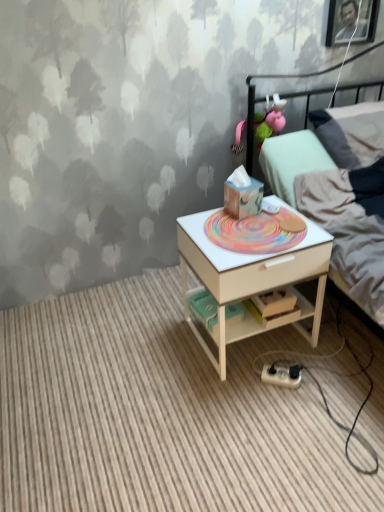
The image size is (384, 512). Identify the location of pink fabric toy at upper center. coord(269,120).

Identify the location of light gray fabric bed at upper right. (346, 215).

What do you see at coordinates (282, 375) in the screenshot?
I see `white plastic power strip at lower center` at bounding box center [282, 375].

This screenshot has height=512, width=384. Identify the location of pink fabric toy at upper center. (269, 120).

From the image's perspective, is white wood desk at center above or below light gray fabric bed at upper right?

Clearly, from the image's perspective, white wood desk at center is below light gray fabric bed at upper right.

Which point is more distant from viewer, (205, 258) or (336, 266)?

The point (336, 266) is farther from the camera.

Can you confirm if white wood desk at center is wider than light gray fabric bed at upper right?

No, white wood desk at center is not wider than light gray fabric bed at upper right.

Considering the sizes of objects white wood desk at center and light gray fabric bed at upper right in the image provided, who is smaller, white wood desk at center or light gray fabric bed at upper right?

white wood desk at center.

Does white plastic power strip at lower center touch white wood nightstand at center?

white plastic power strip at lower center and white wood nightstand at center are clearly separated.

Can you confirm if white plastic power strip at lower center is positioned to the right of white wood nightstand at center?

Yes, white plastic power strip at lower center is to the right of white wood nightstand at center.

Does point (280, 376) come farther from viewer compared to point (142, 413)?

That is True.

Can you confirm if white plastic power strip at lower center is wider than white wood nightstand at center?

In fact, white plastic power strip at lower center might be narrower than white wood nightstand at center.

Image resolution: width=384 pixels, height=512 pixels. I want to click on desk in front of the pink fabric toy at upper center, so click(250, 279).

Is white wood desk at center thinner than pink fabric toy at upper center?

No, white wood desk at center is not thinner than pink fabric toy at upper center.

Looking at the image, does white wood desk at center seem bigger or smaller compared to pink fabric toy at upper center?

Considering their sizes, white wood desk at center takes up more space than pink fabric toy at upper center.

In the scene shown: Is white wood desk at center shorter than pink fabric toy at upper center?

No.

Does point (290, 370) come behind point (320, 260)?

Yes, point (290, 370) is farther from viewer.

Considering their positions, is white plastic power strip at lower center located in front of or behind white wood desk at center?

Clearly, white plastic power strip at lower center is behind white wood desk at center.

Who is shorter, white plastic power strip at lower center or white wood desk at center?

white plastic power strip at lower center.

In the scene shown: Is white wood nightstand at center next to light gray fabric bed at upper right and touching it?

There is a gap between white wood nightstand at center and light gray fabric bed at upper right.

Is white wood nightstand at center to the left or to the right of light gray fabric bed at upper right in the image?

In the image, white wood nightstand at center appears on the left side of light gray fabric bed at upper right.

Where is `bed on the right of white wood nightstand at center`? Image resolution: width=384 pixels, height=512 pixels. bed on the right of white wood nightstand at center is located at coordinates (346, 215).

Is pink fabric toy at upper center positioned far away from white wood nightstand at center?

Yes, pink fabric toy at upper center and white wood nightstand at center are quite far apart.

Is pink fabric toy at upper center thinner than white wood nightstand at center?

Yes.

From a real-world perspective, between pink fabric toy at upper center and white wood nightstand at center, who is vertically higher?

pink fabric toy at upper center, from a real-world perspective.

Is pink fabric toy at upper center in front of white wood nightstand at center?

No, pink fabric toy at upper center is further to the viewer.

Which of these two, light gray fabric bed at upper right or white wood desk at center, is thinner?

white wood desk at center.

From the image's perspective, is light gray fabric bed at upper right on top of white wood desk at center?

Yes, from the image's perspective, light gray fabric bed at upper right is over white wood desk at center.

Considering the positions of objects light gray fabric bed at upper right and white wood desk at center in the image provided, who is more to the right, light gray fabric bed at upper right or white wood desk at center?

light gray fabric bed at upper right.

Find the location of a particular element. The image size is (384, 512). desk below the light gray fabric bed at upper right (from a real-world perspective) is located at coordinates (250, 279).

Identify the location of equipment above the white wood nightstand at center (from a real-world perspective). This screenshot has height=512, width=384. (282, 375).

Looking at the image, which one is located closer to light gray fabric bed at upper right, white wood desk at center or white wood nightstand at center?

white wood desk at center.

From the image, which object appears to be nearer to white plastic power strip at lower center, pink fabric toy at upper center or white wood nightstand at center?

The object closer to white plastic power strip at lower center is white wood nightstand at center.

Looking at the image, which one is located closer to white plastic power strip at lower center, white wood nightstand at center or pink fabric toy at upper center?

Among the two, white wood nightstand at center is located nearer to white plastic power strip at lower center.

Estimate the real-world distances between objects in this image. Which object is closer to light gray fabric bed at upper right, white wood nightstand at center or white plastic power strip at lower center?

white plastic power strip at lower center lies closer to light gray fabric bed at upper right than the other object.

Based on their spatial positions, is white plastic power strip at lower center or white wood nightstand at center further from light gray fabric bed at upper right?

white wood nightstand at center.

From the image, which object appears to be nearer to light gray fabric bed at upper right, white wood nightstand at center or pink fabric toy at upper center?

pink fabric toy at upper center.

Which object lies nearer to the anchor point white wood desk at center, pink fabric toy at upper center or white wood nightstand at center?

white wood nightstand at center lies closer to white wood desk at center than the other object.

Estimate the real-world distances between objects in this image. Which object is closer to white wood nightstand at center, white wood desk at center or light gray fabric bed at upper right?

The object closer to white wood nightstand at center is white wood desk at center.

Find the location of a particular element. The image size is (384, 512). bed that lies between pink fabric toy at upper center and white wood nightstand at center from top to bottom is located at coordinates (346, 215).

Image resolution: width=384 pixels, height=512 pixels. I want to click on desk located between white wood nightstand at center and white plastic power strip at lower center in the depth direction, so click(250, 279).

This screenshot has height=512, width=384. Identify the location of desk between pink fabric toy at upper center and white wood nightstand at center in the up-down direction. (250, 279).

At what (x,y) coordinates should I click in order to perform the action: click on bed that lies between pink fabric toy at upper center and white wood desk at center from top to bottom. Please return your answer as a coordinate pair (x, y). Looking at the image, I should click on (346, 215).